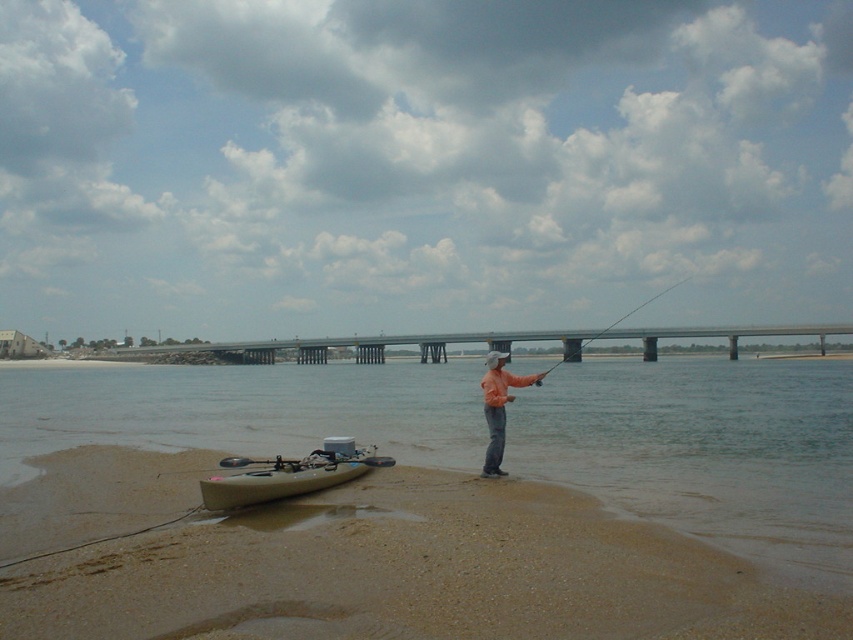
You are a photographer planning to take a photo of the beige plastic kayak at lower left and tan matte kayak at lower left from a low angle. Which kayak will appear taller in the photo?

The tan matte kayak at lower left will appear taller in the photo because it is taller than the beige plastic kayak at lower left.

You are a photographer trying to capture the orange matte jacket at center and the smooth fiberglass rod at center in the same frame. Which object should you zoom in on to ensure both are visible without moving the camera?

The orange matte jacket at center is smaller than the smooth fiberglass rod at center, so you should zoom in on the larger object, the smooth fiberglass rod at center, to include both in the frame.

You are standing at the center of the image and want to move towards the beige plastic kayak at lower left. Which direction should you move in?

The beige plastic kayak at lower left is located at point [366,563], so you should move towards the lower left direction to reach it.